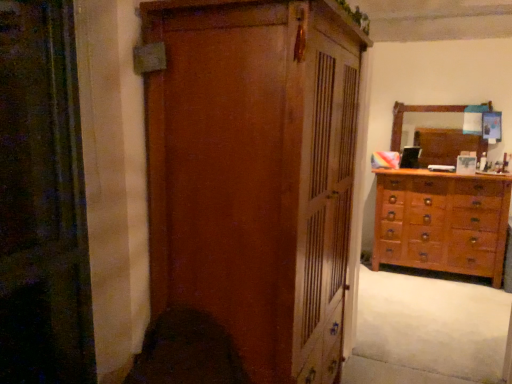
Question: Is wooden dresser at right taller or shorter than wooden wardrobe at center?

Choices:
 (A) short
 (B) tall

Answer: (A)

Question: Considering the positions of wooden dresser at right and wooden wardrobe at center in the image, is wooden dresser at right bigger or smaller than wooden wardrobe at center?

Choices:
 (A) small
 (B) big

Answer: (A)

Question: Which object is positioned farthest from the wooden mirror at upper right?

Choices:
 (A) wooden dresser at right
 (B) wooden wardrobe at center
 (C) white soft carpet at lower right

Answer: (B)

Question: Considering the real-world distances, which object is farthest from the white soft carpet at lower right?

Choices:
 (A) wooden mirror at upper right
 (B) wooden dresser at right
 (C) wooden wardrobe at center

Answer: (C)